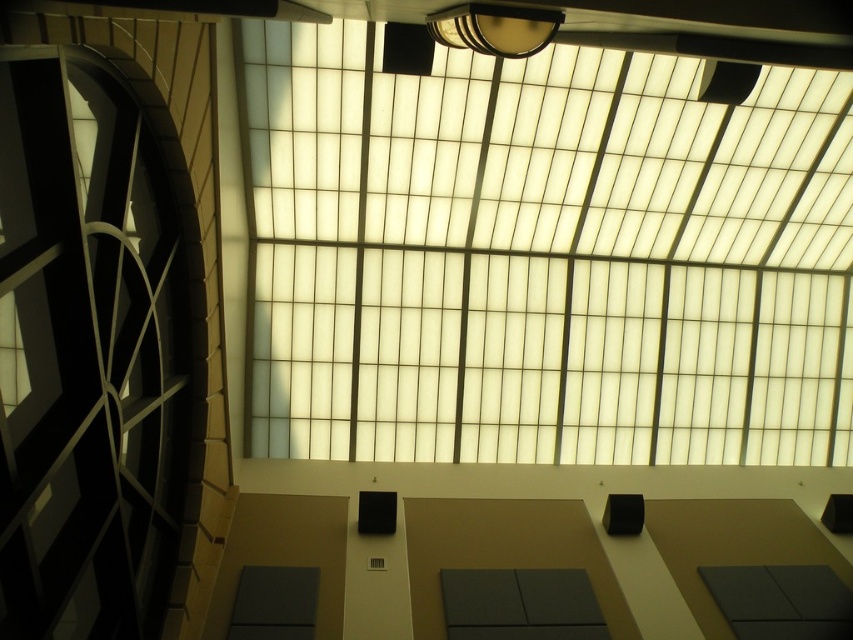
Can you confirm if matte black clock at left is positioned to the right of metallic gold lamp at upper center?

Incorrect, matte black clock at left is not on the right side of metallic gold lamp at upper center.

The image size is (853, 640). What do you see at coordinates (86, 358) in the screenshot?
I see `matte black clock at left` at bounding box center [86, 358].

Is point (7, 580) positioned in front of point (509, 12)?

No, (7, 580) is further to viewer.

The width and height of the screenshot is (853, 640). I want to click on matte black clock at left, so click(x=86, y=358).

Can you confirm if white frosted glass at upper center is positioned above metallic gold lamp at upper center?

No, white frosted glass at upper center is not above metallic gold lamp at upper center.

Measure the distance between white frosted glass at upper center and camera.

white frosted glass at upper center is 26.50 meters away from camera.

The width and height of the screenshot is (853, 640). What do you see at coordinates (538, 256) in the screenshot?
I see `white frosted glass at upper center` at bounding box center [538, 256].

Find the location of a particular element. The width and height of the screenshot is (853, 640). white frosted glass at upper center is located at coordinates (538, 256).

Consider the image. Can you confirm if white frosted glass at upper center is shorter than matte black clock at left?

Incorrect, white frosted glass at upper center's height does not fall short of matte black clock at left's.

Does white frosted glass at upper center come behind matte black clock at left?

Yes, it is.

Locate an element on the screen. The width and height of the screenshot is (853, 640). white frosted glass at upper center is located at coordinates (538, 256).